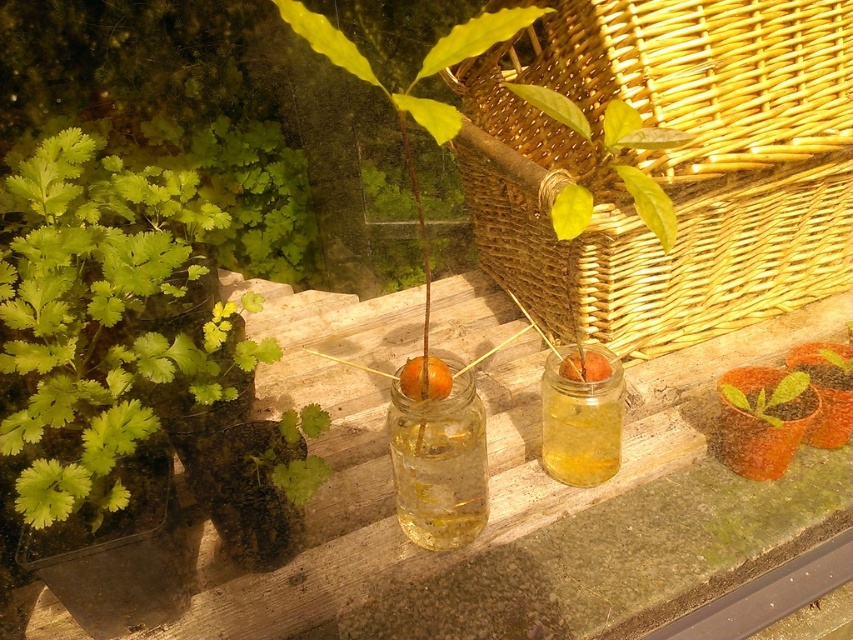
Is woven wicker basket at upper right wider than green leafy plant at center?

Answer: Indeed, woven wicker basket at upper right has a greater width compared to green leafy plant at center.

Is point (558, 269) closer to camera compared to point (755, 401)?

No, (558, 269) is further to viewer.

Between point (756, 22) and point (788, 376), which one is positioned behind?

The point (788, 376) is more distant.

At what (x,y) coordinates should I click in order to perform the action: click on woven wicker basket at upper right. Please return your answer as a coordinate pair (x, y). Looking at the image, I should click on (668, 164).

Is point (581, 198) less distant than point (419, 387)?

That is True.

Does point (636, 115) lie behind point (444, 381)?

No, (636, 115) is closer to viewer.

The height and width of the screenshot is (640, 853). What do you see at coordinates (618, 150) in the screenshot?
I see `green leafy plant at upper center` at bounding box center [618, 150].

Locate an element on the screen. The height and width of the screenshot is (640, 853). green leafy plant at upper center is located at coordinates (618, 150).

Can you confirm if clear glass jar at center is wider than translucent yellow glass jar at center?

Yes, clear glass jar at center is wider than translucent yellow glass jar at center.

Which of these two, clear glass jar at center or translucent yellow glass jar at center, stands shorter?

translucent yellow glass jar at center

Is point (434, 413) positioned behind point (590, 387)?

No, it is in front of (590, 387).

Locate an element on the screen. The height and width of the screenshot is (640, 853). clear glass jar at center is located at coordinates (439, 465).